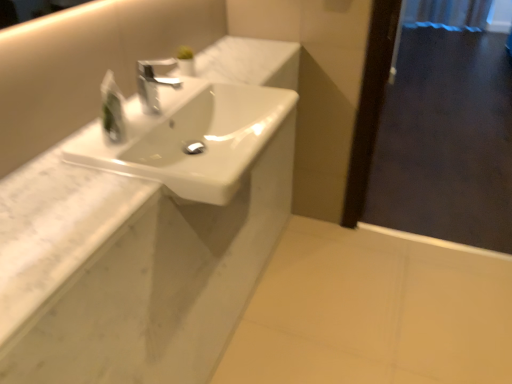
Question: Is white glossy sink at center positioned with its back to satin nickel faucet at center?

Choices:
 (A) no
 (B) yes

Answer: (A)

Question: From the image's perspective, does white glossy sink at center appear higher than satin nickel faucet at center?

Choices:
 (A) yes
 (B) no

Answer: (B)

Question: Is white glossy sink at center outside of satin nickel faucet at center?

Choices:
 (A) no
 (B) yes

Answer: (B)

Question: Could satin nickel faucet at center be considered to be inside white glossy sink at center?

Choices:
 (A) no
 (B) yes

Answer: (A)

Question: Considering the relative sizes of white glossy sink at center and satin nickel faucet at center in the image provided, is white glossy sink at center smaller than satin nickel faucet at center?

Choices:
 (A) yes
 (B) no

Answer: (B)

Question: Is white glossy sink at center at the right side of satin nickel faucet at center?

Choices:
 (A) no
 (B) yes

Answer: (B)

Question: Could you tell me if white glossy sink at center is facing translucent plastic soap dispenser at upper left?

Choices:
 (A) yes
 (B) no

Answer: (B)

Question: Does white glossy sink at center have a larger size compared to translucent plastic soap dispenser at upper left?

Choices:
 (A) no
 (B) yes

Answer: (B)

Question: Does white glossy sink at center contain translucent plastic soap dispenser at upper left?

Choices:
 (A) no
 (B) yes

Answer: (A)

Question: Would you consider white glossy sink at center to be distant from translucent plastic soap dispenser at upper left?

Choices:
 (A) yes
 (B) no

Answer: (B)

Question: Is white glossy sink at center next to translucent plastic soap dispenser at upper left and touching it?

Choices:
 (A) no
 (B) yes

Answer: (A)

Question: From a real-world perspective, is white glossy sink at center on top of translucent plastic soap dispenser at upper left?

Choices:
 (A) no
 (B) yes

Answer: (A)

Question: Is the depth of white marble counter at upper left less than that of white glossy sink at center?

Choices:
 (A) no
 (B) yes

Answer: (B)